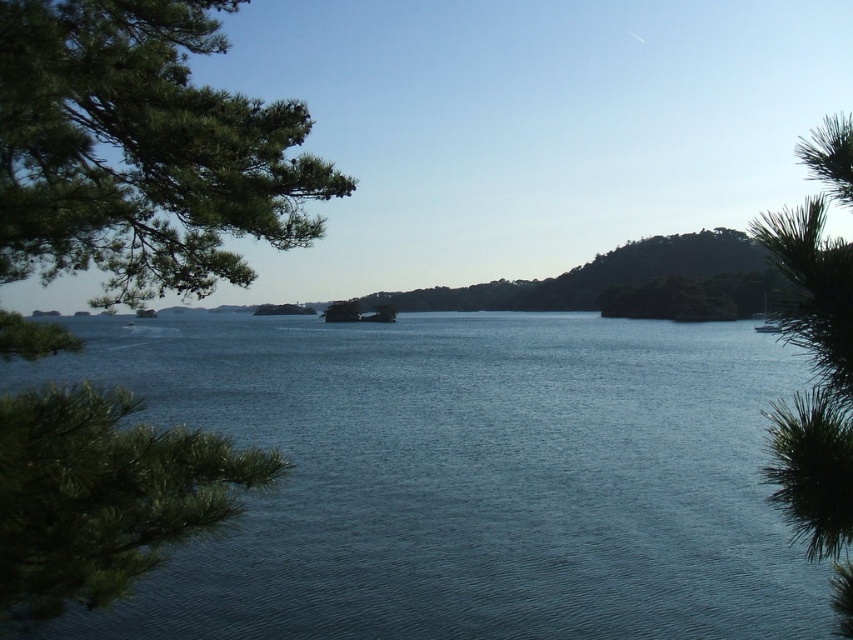
Is green needle-like leaves at right bigger than white glossy boat at center?

Yes, green needle-like leaves at right is bigger than white glossy boat at center.

Based on the photo, can you confirm if green needle-like leaves at right is positioned to the left of white glossy boat at center?

Incorrect, green needle-like leaves at right is not on the left side of white glossy boat at center.

Identify the location of green needle-like leaves at right. (817, 362).

Identify the location of green needle-like leaves at right. The width and height of the screenshot is (853, 640). (817, 362).

In the scene shown: Between blue water at center and white glossy boat at center, which one is positioned lower?

Positioned lower is blue water at center.

Describe the element at coordinates (469, 477) in the screenshot. The height and width of the screenshot is (640, 853). I see `blue water at center` at that location.

The image size is (853, 640). Find the location of `blue water at center`. blue water at center is located at coordinates (469, 477).

Consider the image. Who is higher up, blue water at center or green matte tree at left?

green matte tree at left is above.

Is the position of blue water at center less distant than that of green matte tree at left?

That is True.

Is point (534, 342) positioned behind point (59, 225)?

Yes, it is.

The width and height of the screenshot is (853, 640). I want to click on blue water at center, so click(469, 477).